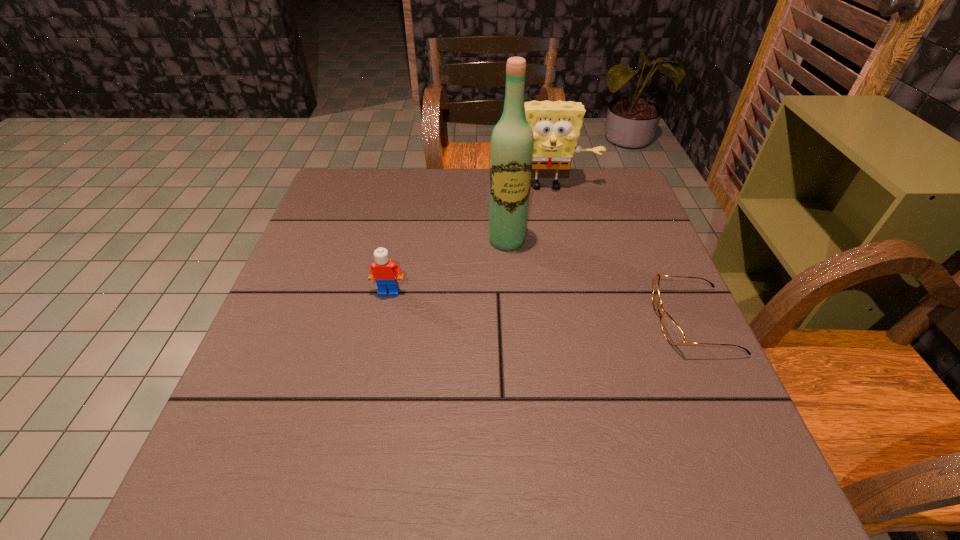
This screenshot has height=540, width=960. I want to click on vacant area situated on the front-facing side of the shortest object, so click(576, 321).

The height and width of the screenshot is (540, 960). What are the coordinates of `vacant region located 0.070m on the front-facing side of the shortest object` in the screenshot? It's located at (623, 321).

The width and height of the screenshot is (960, 540). Identify the location of free spot located 0.060m on the face of the farthest object. (548, 208).

Find the location of a particular element. vacant space located on the face of the farthest object is located at coordinates (555, 253).

The image size is (960, 540). I want to click on free point located on the face of the farthest object, so click(552, 233).

Locate an element on the screen. vacant region located 0.260m on the front-facing side of the wine bottle is located at coordinates (524, 335).

Identify the location of vacant space located on the front-facing side of the wine bottle. (515, 284).

Where is `vacant region located 0.240m on the front-facing side of the wine bottle`? vacant region located 0.240m on the front-facing side of the wine bottle is located at coordinates (522, 327).

Image resolution: width=960 pixels, height=540 pixels. I want to click on object located in the far edge section of the desktop, so click(556, 126).

Locate an element on the screen. The width and height of the screenshot is (960, 540). spectacles located at the right edge is located at coordinates (674, 334).